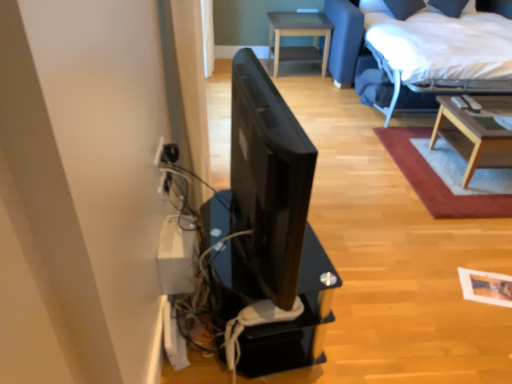
The height and width of the screenshot is (384, 512). Identify the location of black glossy monitor at center. (267, 184).

Locate an element on the screen. The width and height of the screenshot is (512, 384). white fabric bed at upper right is located at coordinates click(x=440, y=50).

The height and width of the screenshot is (384, 512). What do you see at coordinates (298, 35) in the screenshot? I see `light brown wooden table at upper center, the 1th table from the back` at bounding box center [298, 35].

Locate an element on the screen. This screenshot has width=512, height=384. wooden coffee table at upper right is located at coordinates (437, 179).

The width and height of the screenshot is (512, 384). Describe the element at coordinates (437, 179) in the screenshot. I see `wooden coffee table at upper right` at that location.

Where is `black glossy monitor at center`? This screenshot has width=512, height=384. black glossy monitor at center is located at coordinates (267, 184).

Identify the location of computer monitor lying on the left of wooden coffee table at upper right. This screenshot has width=512, height=384. (x=267, y=184).

Which of these two, wooden coffee table at upper right or black glossy monitor at center, is thinner?

Thinner between the two is black glossy monitor at center.

Is wooden coffee table at upper right taller than black glossy monitor at center?

Incorrect, the height of wooden coffee table at upper right is not larger of that of black glossy monitor at center.

Which is closer to the camera, (476, 202) or (262, 86)?

The point (262, 86) is more forward.

From a real-world perspective, is black glossy monitor at center above or below light brown wooden table at upper center, placed as the second table when sorted from bottom to top?

black glossy monitor at center is situated higher than light brown wooden table at upper center, placed as the second table when sorted from bottom to top, in the real world.

Is black glossy monitor at center next to light brown wooden table at upper center, marked as the second table in a right-to-left arrangement, and touching it?

black glossy monitor at center and light brown wooden table at upper center, marked as the second table in a right-to-left arrangement, are clearly separated.

Which is more to the left, black glossy monitor at center or light brown wooden table at upper center, the 1th table from the back?

Positioned to the left is black glossy monitor at center.

Which is behind, black glossy monitor at center or light brown wooden table at upper center, the first table from the left?

light brown wooden table at upper center, the first table from the left, is more distant.

From the image's perspective, which is above, white fabric bed at upper right or wooden coffee table at upper right?

white fabric bed at upper right is shown above in the image.

Identify the location of plain on the left of the white fabric bed at upper right. (437, 179).

Is white fabric bed at upper right looking in the opposite direction of wooden coffee table at upper right?

No.

From a real-world perspective, is light wood/texture coffee table at upper right, placed as the 2th table when sorted from back to front, below black glossy monitor at center?

Yes, from a real-world perspective, light wood/texture coffee table at upper right, placed as the 2th table when sorted from back to front, is below black glossy monitor at center.

From the image's perspective, which is below, light wood/texture coffee table at upper right, which ranks as the 1th table in front-to-back order, or black glossy monitor at center?

black glossy monitor at center, from the image's perspective.

Is light wood/texture coffee table at upper right, which ranks as the 1th table in front-to-back order, oriented towards black glossy monitor at center?

No, light wood/texture coffee table at upper right, which ranks as the 1th table in front-to-back order, is not oriented towards black glossy monitor at center.

Measure the distance between light wood/texture coffee table at upper right, placed as the 2th table when sorted from back to front, and black glossy monitor at center.

The distance of light wood/texture coffee table at upper right, placed as the 2th table when sorted from back to front, from black glossy monitor at center is 1.91 meters.

Does wooden coffee table at upper right have a greater height compared to light wood/texture coffee table at upper right, positioned as the 2th table in left-to-right order?

No, wooden coffee table at upper right is not taller than light wood/texture coffee table at upper right, positioned as the 2th table in left-to-right order.

Is wooden coffee table at upper right in front of light wood/texture coffee table at upper right, placed as the first table when sorted from right to left?

Yes.

Can you tell me how much wooden coffee table at upper right and light wood/texture coffee table at upper right, which is counted as the 2th table, starting from the top, differ in facing direction?

wooden coffee table at upper right and light wood/texture coffee table at upper right, which is counted as the 2th table, starting from the top, are facing 0.338 degrees away from each other.

Which is more to the left, wooden coffee table at upper right or light wood/texture coffee table at upper right, placed as the 2th table when sorted from back to front?

wooden coffee table at upper right is more to the left.

Would you say white fabric bed at upper right is part of light brown wooden table at upper center, placed as the second table when sorted from bottom to top,'s contents?

No, white fabric bed at upper right is not inside light brown wooden table at upper center, placed as the second table when sorted from bottom to top.

Based on the photo, is light brown wooden table at upper center, the first table from the left, to the left of white fabric bed at upper right from the viewer's perspective?

Indeed, light brown wooden table at upper center, the first table from the left, is positioned on the left side of white fabric bed at upper right.

Considering their positions, is light wood/texture coffee table at upper right, placed as the 2th table when sorted from back to front, located in front of or behind white fabric bed at upper right?

In the image, light wood/texture coffee table at upper right, placed as the 2th table when sorted from back to front, appears in front of white fabric bed at upper right.

From a real-world perspective, which is physically above, light wood/texture coffee table at upper right, which ranks as the 1th table in front-to-back order, or white fabric bed at upper right?

From a 3D spatial view, white fabric bed at upper right is above.

In terms of size, does light wood/texture coffee table at upper right, placed as the 2th table when sorted from back to front, appear bigger or smaller than white fabric bed at upper right?

light wood/texture coffee table at upper right, placed as the 2th table when sorted from back to front, is smaller than white fabric bed at upper right.

Is light wood/texture coffee table at upper right, which is counted as the 2th table, starting from the top, positioned with its back to white fabric bed at upper right?

Yes, light wood/texture coffee table at upper right, which is counted as the 2th table, starting from the top, is facing away from white fabric bed at upper right.

Find the location of a particular element. The image size is (512, 384). plain behind the black glossy monitor at center is located at coordinates (437, 179).

Image resolution: width=512 pixels, height=384 pixels. Identify the location of computer monitor that is on the left side of light brown wooden table at upper center, the 2th table when ordered from front to back. (267, 184).

Which object lies nearer to the anchor point light wood/texture coffee table at upper right, placed as the first table when sorted from right to left, wooden coffee table at upper right or white fabric bed at upper right?

The object closer to light wood/texture coffee table at upper right, placed as the first table when sorted from right to left, is wooden coffee table at upper right.

Estimate the real-world distances between objects in this image. Which object is further from light wood/texture coffee table at upper right, which is counted as the 2th table, starting from the top, light brown wooden table at upper center, marked as the second table in a right-to-left arrangement, or wooden coffee table at upper right?

Based on the image, light brown wooden table at upper center, marked as the second table in a right-to-left arrangement, appears to be further to light wood/texture coffee table at upper right, which is counted as the 2th table, starting from the top.

Based on the photo, based on their spatial positions, is light brown wooden table at upper center, which is the first table from top to bottom, or wooden coffee table at upper right closer to black glossy monitor at center?

wooden coffee table at upper right is closer to black glossy monitor at center.

Looking at the image, which one is located further to wooden coffee table at upper right, light brown wooden table at upper center, the first table from the left, or light wood/texture coffee table at upper right, positioned as the 2th table in left-to-right order?

light brown wooden table at upper center, the first table from the left, is further to wooden coffee table at upper right.

In the scene shown: Considering their positions, is white fabric bed at upper right positioned closer to black glossy monitor at center than light brown wooden table at upper center, which is the first table from top to bottom?

Among the two, white fabric bed at upper right is located nearer to black glossy monitor at center.

From the image, which object appears to be farther from light wood/texture coffee table at upper right, placed as the first table when sorted from right to left, wooden coffee table at upper right or light brown wooden table at upper center, which is the first table from top to bottom?

light brown wooden table at upper center, which is the first table from top to bottom.

When comparing their distances from white fabric bed at upper right, does light wood/texture coffee table at upper right, which is counted as the 2th table, starting from the top, or light brown wooden table at upper center, the first table from the left, seem further?

light brown wooden table at upper center, the first table from the left, lies further to white fabric bed at upper right than the other object.

From the image, which object appears to be farther from white fabric bed at upper right, black glossy monitor at center or light wood/texture coffee table at upper right, the 1th table positioned from the bottom?

black glossy monitor at center is further to white fabric bed at upper right.

Locate an element on the screen. plain between black glossy monitor at center and light brown wooden table at upper center, the 2th table when ordered from front to back, from front to back is located at coordinates tap(437, 179).

I want to click on plain between black glossy monitor at center and light wood/texture coffee table at upper right, which ranks as the 1th table in front-to-back order, in the horizontal direction, so click(x=437, y=179).

At what (x,y) coordinates should I click in order to perform the action: click on bed between wooden coffee table at upper right and light brown wooden table at upper center, the 1th table from the back, along the z-axis. Please return your answer as a coordinate pair (x, y). The image size is (512, 384). Looking at the image, I should click on (440, 50).

Locate an element on the screen. table between black glossy monitor at center and light brown wooden table at upper center, marked as the second table in a right-to-left arrangement, in the front-back direction is located at coordinates (476, 133).